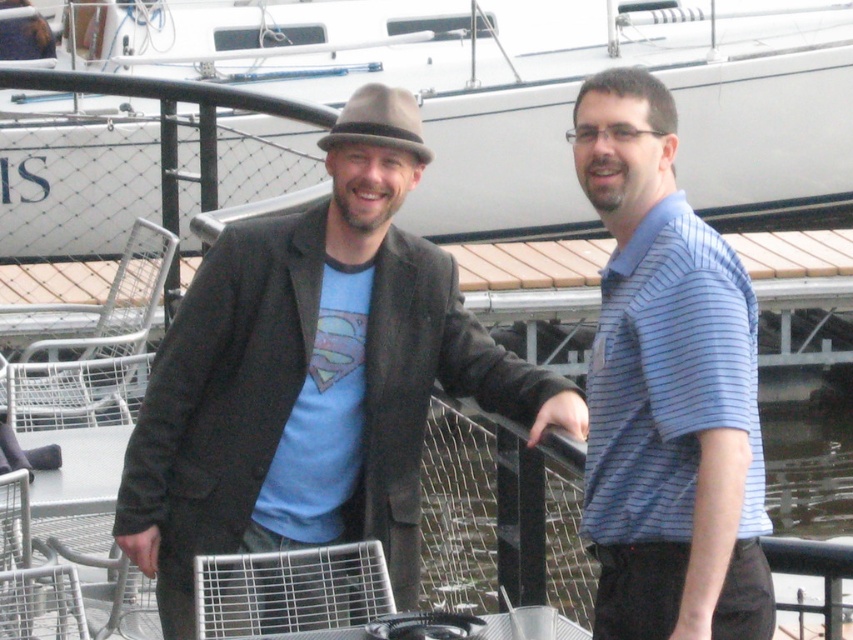
You are a photographer trying to capture a clear shot of both the matte black jacket at center and the brown felt fedora at center. Since the camera has a limited focus range, you need to know which object is wider to adjust the lens properly. Which object has a greater width?

The matte black jacket at center has a greater width than the brown felt fedora at center according to the description.